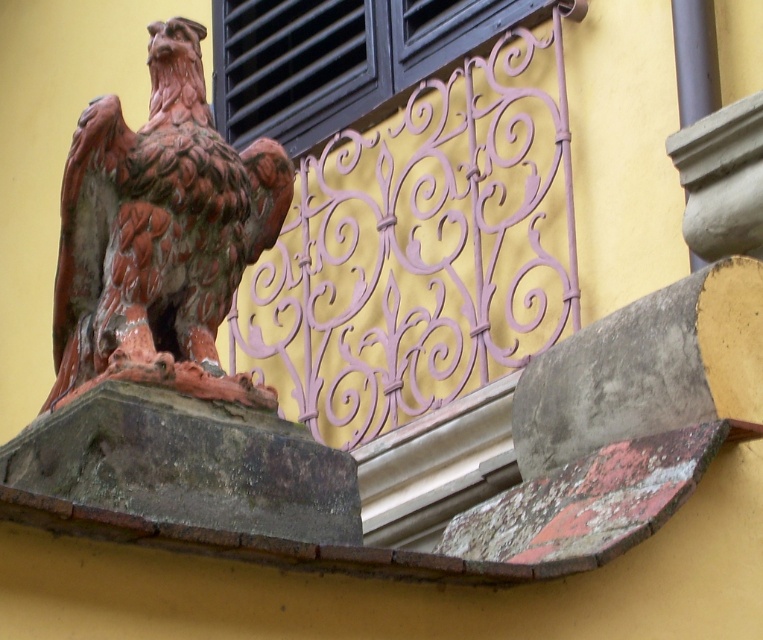
You are standing in front of a building and see the rusty metal eagle at left and the black matte window at upper center. Which object is located higher on the building?

The black matte window at upper center is located higher on the building than the rusty metal eagle at left.